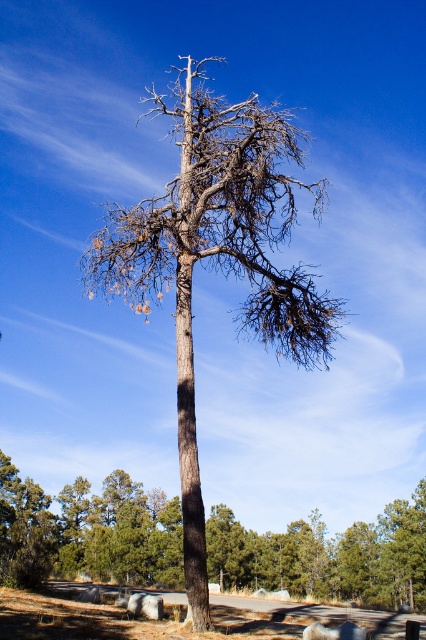
Which is more to the left, brown rough bark tree at center or brown bark tree at center?

brown rough bark tree at center

Does brown rough bark tree at center have a greater height compared to brown bark tree at center?

Yes.

Locate an element on the screen. brown rough bark tree at center is located at coordinates (215, 259).

Locate an element on the screen. The image size is (426, 640). brown rough bark tree at center is located at coordinates (215, 259).